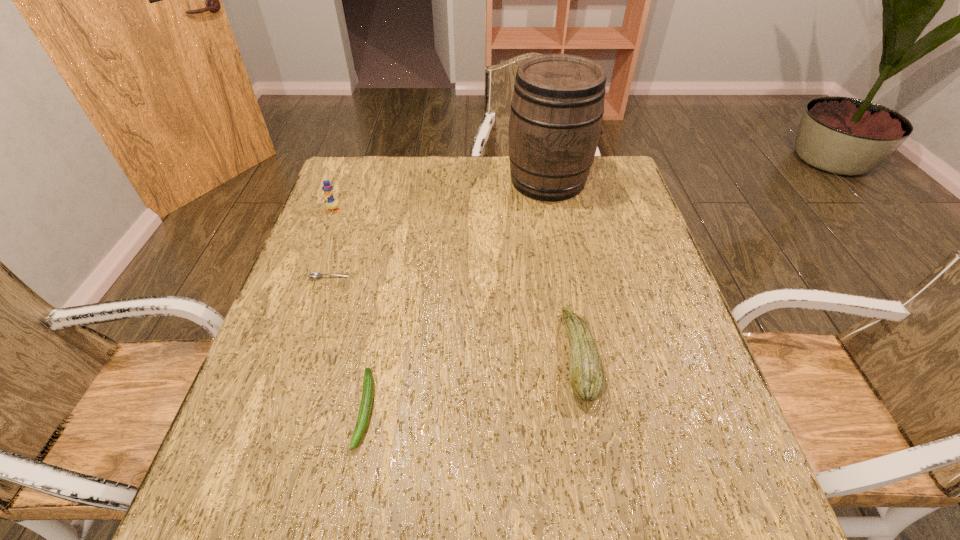
Identify the location of object that is at the right edge. (557, 107).

Find the location of a particular element. Image resolution: width=960 pixels, height=540 pixels. object present at the far right corner is located at coordinates (557, 107).

In the image, there is a desktop. What are the coordinates of `vacant space at the far edge` in the screenshot? It's located at (454, 158).

The width and height of the screenshot is (960, 540). Find the location of `free region at the near edge of the desktop`. free region at the near edge of the desktop is located at coordinates (624, 503).

Where is `blank space at the left edge of the desktop`? The image size is (960, 540). blank space at the left edge of the desktop is located at coordinates (342, 205).

You are a GUI agent. You are given a task and a screenshot of the screen. Output one action in this format:
    pyautogui.click(x=<x>, y=<y>)
    Task: Click on the free spot at the right edge of the desktop
    This screenshot has width=960, height=540.
    Given the screenshot: What is the action you would take?
    pyautogui.click(x=596, y=212)

The width and height of the screenshot is (960, 540). Identify the location of blank space at the far left corner. (377, 172).

In order to click on vacant area at the near right corner of the desktop in this screenshot , I will do `click(741, 485)`.

You are a GUI agent. You are given a task and a screenshot of the screen. Output one action in this format:
    pyautogui.click(x=<x>, y=<y>)
    Task: Click on the vacant area between the third farthest object and the duckling
    Image resolution: width=960 pixels, height=540 pixels.
    Given the screenshot: What is the action you would take?
    pyautogui.click(x=331, y=244)

At what (x,y) coordinates should I click in order to perform the action: click on free spot between the right zucchini and the tallest object. Please return your answer as a coordinate pair (x, y). The image size is (960, 540). Looking at the image, I should click on (564, 268).